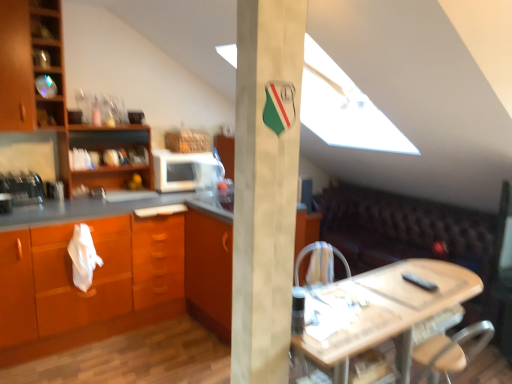
Question: Is white matte pillar at center spatially inside wooden cabinet at left, which appears as the second cabinetry when ordered from the bottom, or outside of it?

Choices:
 (A) inside
 (B) outside

Answer: (B)

Question: In terms of size, does white matte pillar at center appear bigger or smaller than wooden cabinet at left, the 1th cabinetry from the top?

Choices:
 (A) small
 (B) big

Answer: (B)

Question: Considering the real-world distances, which object is closest to the wooden cabinet at left, the 1th cabinetry from the top?

Choices:
 (A) white fabric armchair at center
 (B) wooden shelves at left
 (C) white matte microwave at center, which ranks as the first appliance in back-to-front order
 (D) matte wood countertop at left
 (E) metallic silver toaster at left, which is the 2th appliance in back-to-front order

Answer: (B)

Question: Which object is positioned closest to the white matte microwave at center, the second appliance from the left?

Choices:
 (A) wooden cabinet at left, the 2th cabinetry positioned from the right
 (B) metallic silver toaster at left, the 2th appliance from the right
 (C) wooden shelves at left
 (D) brown leather couch at lower right
 (E) orange wood cabinet at left, placed as the 2th cabinetry when sorted from left to right

Answer: (C)